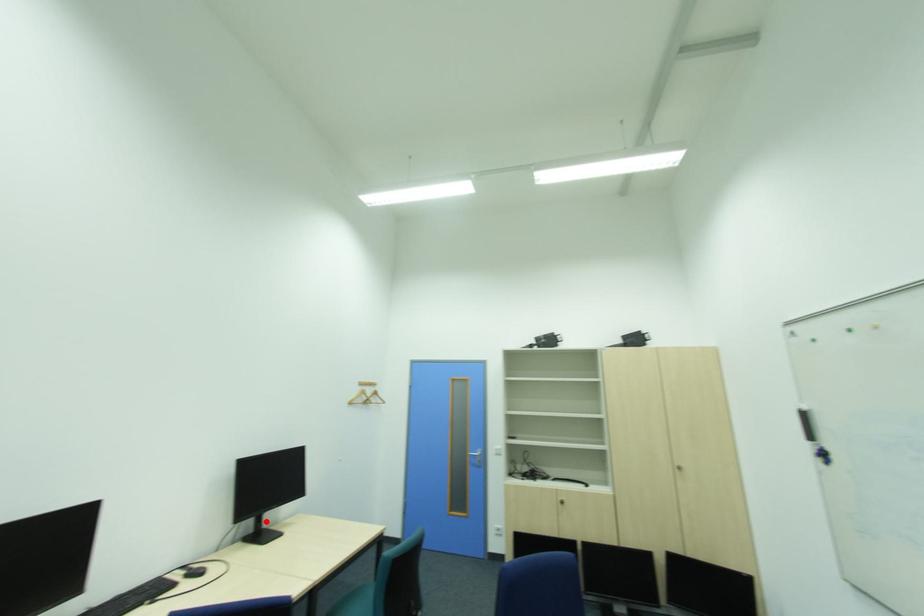
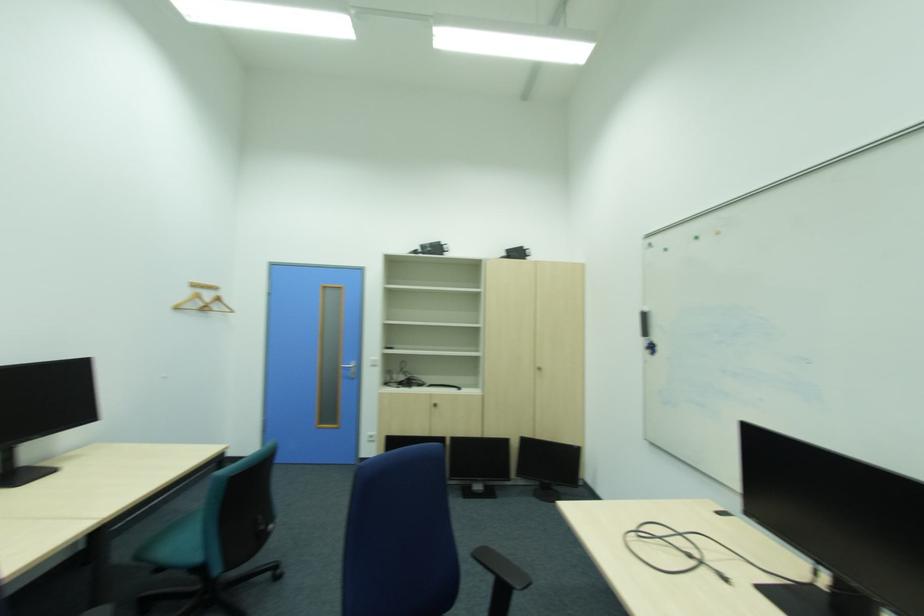
Question: I am providing you with two images of the same scene from different viewpoints. A red point is shown in image1. For the corresponding object point in image2, is it positioned nearer or farther from the camera?

Choices:
 (A) Nearer
 (B) Farther

Answer: (A)